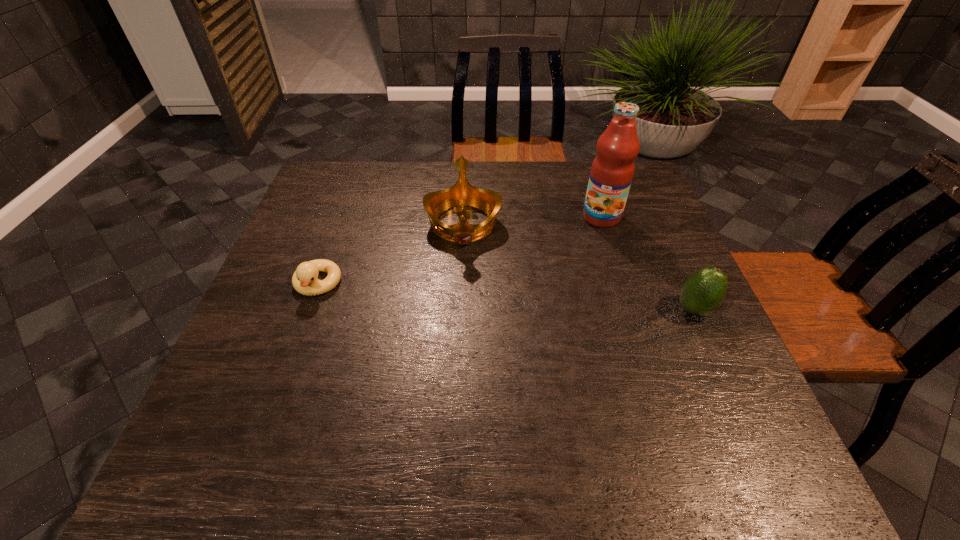
This screenshot has width=960, height=540. In the image, there is a desktop. Find the location of `free region at the far edge`. free region at the far edge is located at coordinates (560, 171).

What are the coordinates of `vacant space at the near edge of the desktop` in the screenshot? It's located at (600, 388).

The image size is (960, 540). In order to click on free space at the left edge of the desktop in this screenshot , I will do `click(286, 309)`.

Where is `free spot at the right edge of the desktop`? free spot at the right edge of the desktop is located at coordinates (693, 347).

You are a GUI agent. You are given a task and a screenshot of the screen. Output one action in this format:
    pyautogui.click(x=<x>, y=<y>)
    Task: Click on the free space at the far left corner of the desktop
    This screenshot has width=960, height=540.
    Given the screenshot: What is the action you would take?
    pyautogui.click(x=353, y=197)

You are a GUI agent. You are given a task and a screenshot of the screen. Output one action in this format:
    pyautogui.click(x=<x>, y=<y>)
    Task: Click on the vacant space at the near left corner
    
    Given the screenshot: What is the action you would take?
    pyautogui.click(x=280, y=400)

This screenshot has height=540, width=960. Identify the location of vacant space at the near right corner of the desktop. (718, 381).

Locate an element on the screen. This screenshot has width=960, height=540. free space between the rightmost object and the leftmost object is located at coordinates (506, 297).

The image size is (960, 540). I want to click on free space between the second object from right to left and the duckling, so click(x=460, y=251).

Image resolution: width=960 pixels, height=540 pixels. What are the coordinates of `vacant area that lies between the tiara and the leftmost object` in the screenshot? It's located at (391, 254).